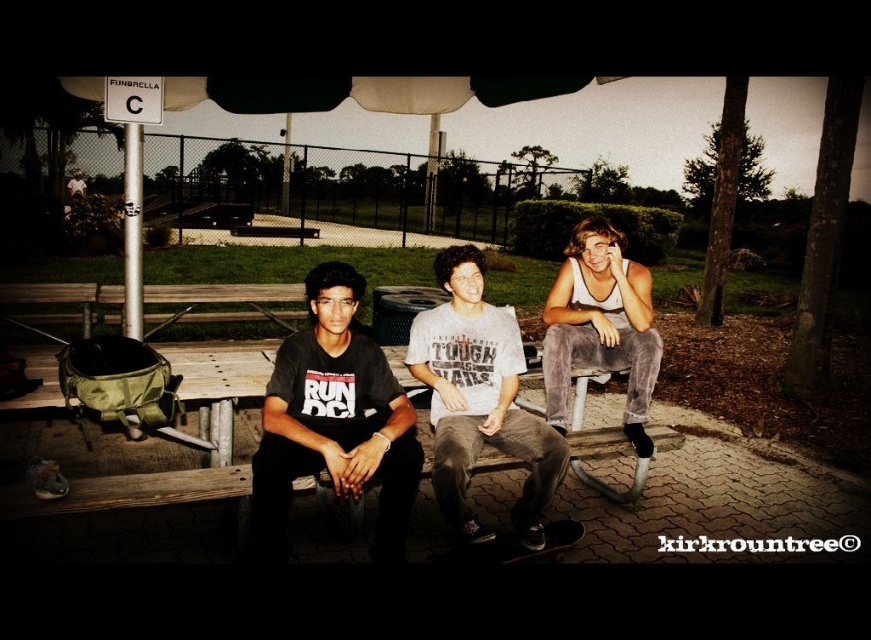
Who is more forward, (294, 417) or (436, 392)?

Point (294, 417) is in front.

Is point (397, 428) more distant than point (437, 400)?

That is False.

Who is more distant from viewer, (311, 472) or (539, 522)?

The point (539, 522) is more distant.

At what (x,y) coordinates should I click in order to perform the action: click on black matte t-shirt at center. Please return your answer as a coordinate pair (x, y). Looking at the image, I should click on point(333,420).

Which is behind, point (440, 282) or point (630, 348)?

Point (630, 348)

Does gray cotton t-shirt at center have a greater width compared to gray velvety pants at center?

Yes.

Describe the element at coordinates (478, 400) in the screenshot. I see `gray cotton t-shirt at center` at that location.

Find the location of a particular element. This screenshot has width=871, height=640. gray cotton t-shirt at center is located at coordinates (478, 400).

Does black matte t-shirt at center have a greater width compared to gray velvety pants at center?

Indeed, black matte t-shirt at center has a greater width compared to gray velvety pants at center.

Between black matte t-shirt at center and gray velvety pants at center, which one is positioned higher?

gray velvety pants at center

Is point (356, 298) positioned in front of point (544, 305)?

Yes, it is in front of point (544, 305).

Where is `black matte t-shirt at center`? This screenshot has height=640, width=871. black matte t-shirt at center is located at coordinates (333, 420).